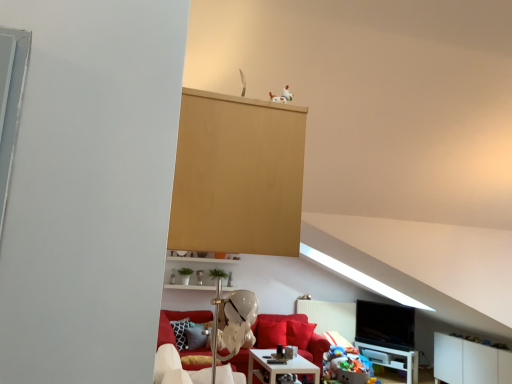
Question: From the image's perspective, would you say white matte cabinet at lower right is shown under white glossy table at lower center, marked as the first table in a left-to-right arrangement?

Choices:
 (A) yes
 (B) no

Answer: (A)

Question: Considering the relative sizes of white matte cabinet at lower right and white glossy table at lower center, the second table viewed from the back, in the image provided, is white matte cabinet at lower right wider than white glossy table at lower center, the second table viewed from the back,?

Choices:
 (A) no
 (B) yes

Answer: (A)

Question: Considering the relative sizes of white matte cabinet at lower right and white glossy table at lower center, the second table viewed from the back, in the image provided, is white matte cabinet at lower right bigger than white glossy table at lower center, the second table viewed from the back,?

Choices:
 (A) no
 (B) yes

Answer: (B)

Question: Is white matte cabinet at lower right thinner than white glossy table at lower center, the first table in the top-to-bottom sequence?

Choices:
 (A) no
 (B) yes

Answer: (B)

Question: Is white glossy table at lower center, the second table when ordered from bottom to top, a part of white matte cabinet at lower right?

Choices:
 (A) yes
 (B) no

Answer: (B)

Question: Considering the relative positions of white matte cabinet at lower right and white glossy table at lower center, the first table in the top-to-bottom sequence, in the image provided, is white matte cabinet at lower right to the right of white glossy table at lower center, the first table in the top-to-bottom sequence, from the viewer's perspective?

Choices:
 (A) no
 (B) yes

Answer: (B)

Question: Is white glossy shelf at lower center directly adjacent to white matte dog at upper center?

Choices:
 (A) yes
 (B) no

Answer: (B)

Question: Can you confirm if white glossy shelf at lower center is taller than white matte dog at upper center?

Choices:
 (A) yes
 (B) no

Answer: (A)

Question: Is white glossy shelf at lower center far away from white matte dog at upper center?

Choices:
 (A) no
 (B) yes

Answer: (B)

Question: Does white glossy shelf at lower center have a lesser height compared to white matte dog at upper center?

Choices:
 (A) yes
 (B) no

Answer: (B)

Question: Is white glossy shelf at lower center thinner than white matte dog at upper center?

Choices:
 (A) yes
 (B) no

Answer: (B)

Question: Can you confirm if white glossy shelf at lower center is positioned to the left of white matte dog at upper center?

Choices:
 (A) no
 (B) yes

Answer: (B)

Question: Can you confirm if multicolored plush toys at lower right is taller than velvet red couch at center?

Choices:
 (A) yes
 (B) no

Answer: (B)